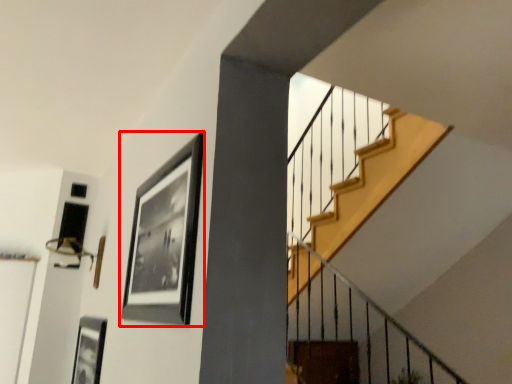
Question: From the image's perspective, what is the correct spatial positioning of picture frame (annotated by the red box) in reference to picture frame?

Choices:
 (A) below
 (B) above

Answer: (B)